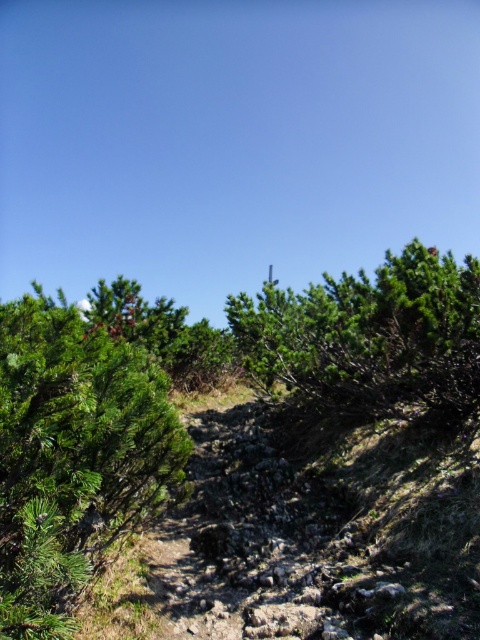
Question: Is green matte bush at left to the left of green matte tree at upper center from the viewer's perspective?

Choices:
 (A) yes
 (B) no

Answer: (A)

Question: Among these points, which one is nearest to the camera?

Choices:
 (A) (115, 342)
 (B) (430, 280)

Answer: (A)

Question: Which point appears farthest from the camera in this image?

Choices:
 (A) (412, 300)
 (B) (54, 557)

Answer: (A)

Question: Does green matte bush at left have a smaller size compared to green matte tree at upper center?

Choices:
 (A) no
 (B) yes

Answer: (B)

Question: Is green matte bush at left closer to the viewer compared to green matte tree at upper center?

Choices:
 (A) yes
 (B) no

Answer: (A)